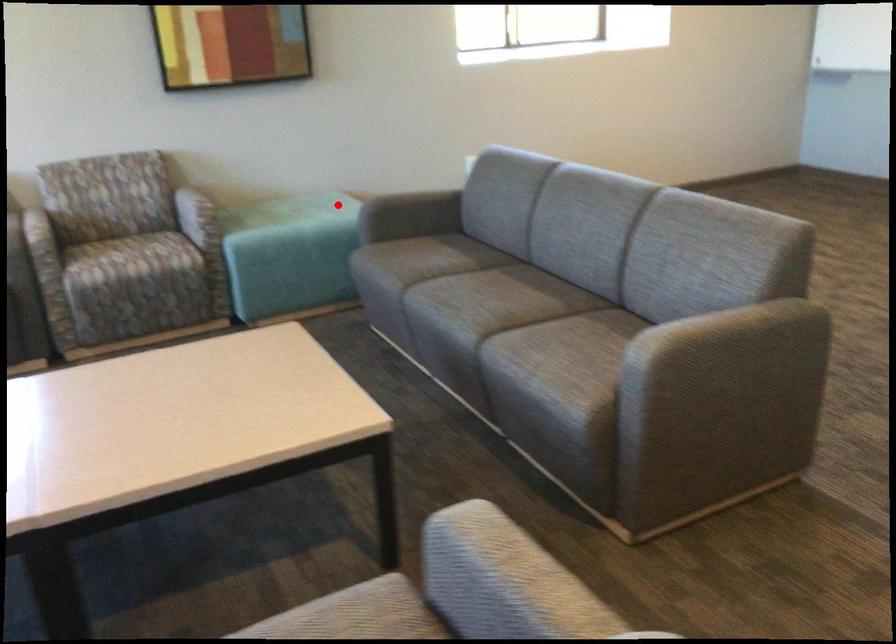
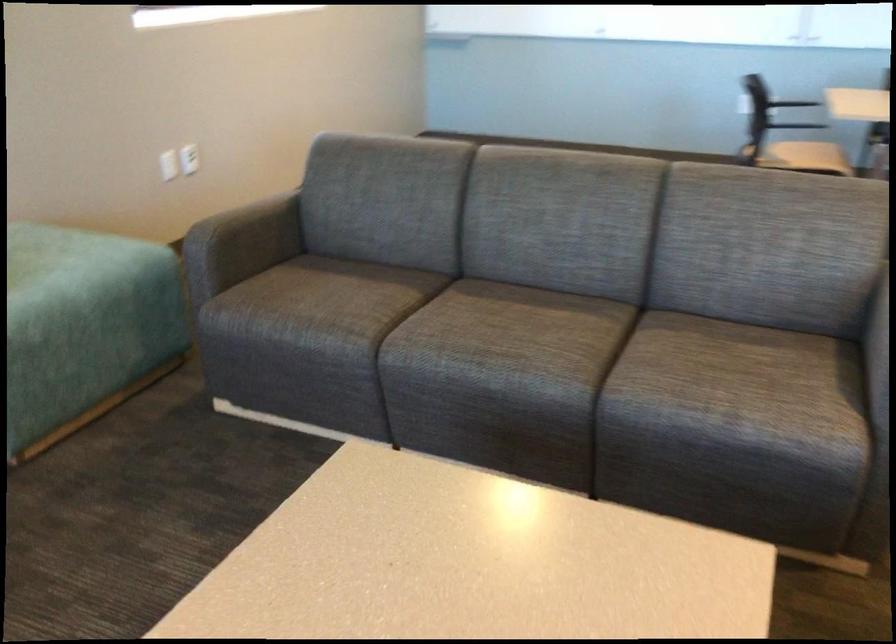
Question: I am providing you with two images of the same scene from different viewpoints. In image1, a red point is highlighted. Considering the same 3D point in image2, which of the following is correct?

Choices:
 (A) It is closer
 (B) It is farther

Answer: (A)